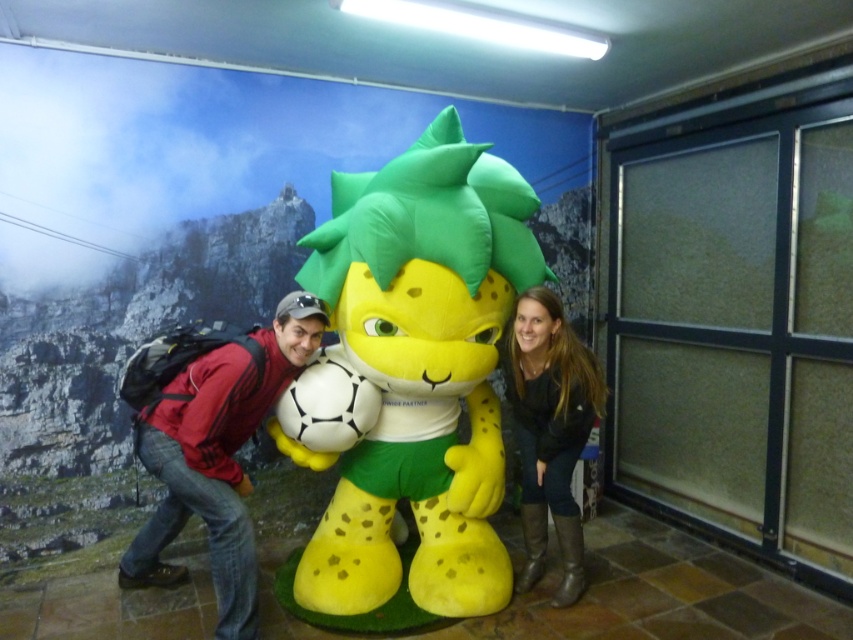
Question: Where is yellow plush mascot at center located in relation to red fleece jacket at left in the image?

Choices:
 (A) below
 (B) above

Answer: (B)

Question: Can you confirm if yellow plush mascot at center is positioned below red fleece jacket at left?

Choices:
 (A) yes
 (B) no

Answer: (B)

Question: Is red fleece jacket at left thinner than dark brown leather boots at lower right?

Choices:
 (A) no
 (B) yes

Answer: (A)

Question: Based on their relative distances, which object is nearer to the yellow plush mascot at center?

Choices:
 (A) dark brown leather boots at lower right
 (B) red fleece jacket at left

Answer: (A)

Question: Among these objects, which one is nearest to the camera?

Choices:
 (A) red fleece jacket at left
 (B) yellow plush mascot at center
 (C) dark brown leather boots at lower right

Answer: (A)

Question: Which object appears farthest from the camera in this image?

Choices:
 (A) yellow plush mascot at center
 (B) red fleece jacket at left
 (C) dark brown leather boots at lower right

Answer: (C)